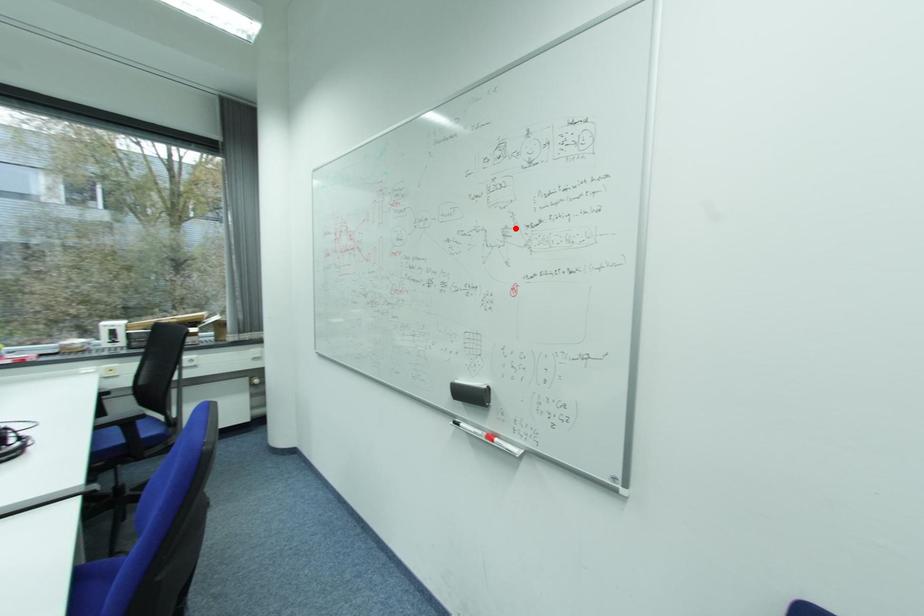
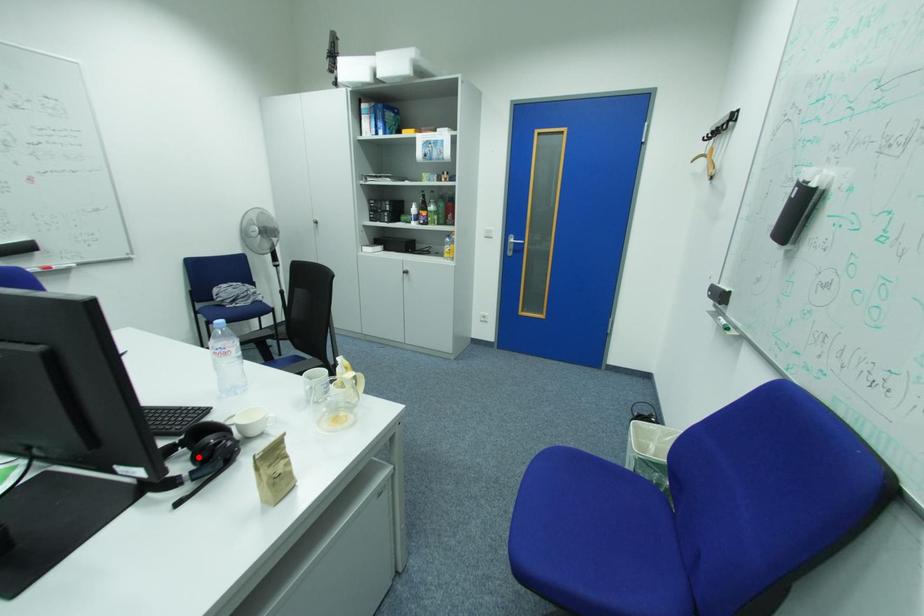
I am providing you with two images of the same scene from different viewpoints. A red point is marked on the first image and another point is marked on the second image. Is the marked point in image1 the same physical position as the marked point in image2?

No